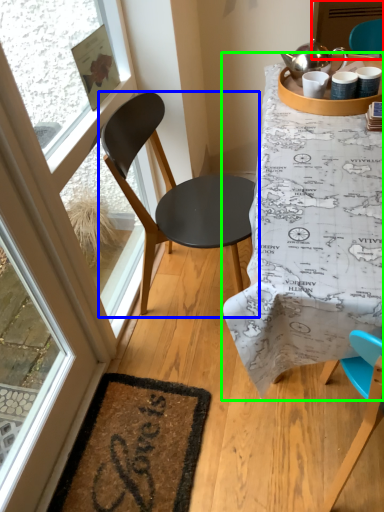
Question: Which object is the closest to the screen door (highlighted by a red box)? Choose among these: chair (highlighted by a blue box) or table (highlighted by a green box).

Choices:
 (A) chair
 (B) table

Answer: (A)